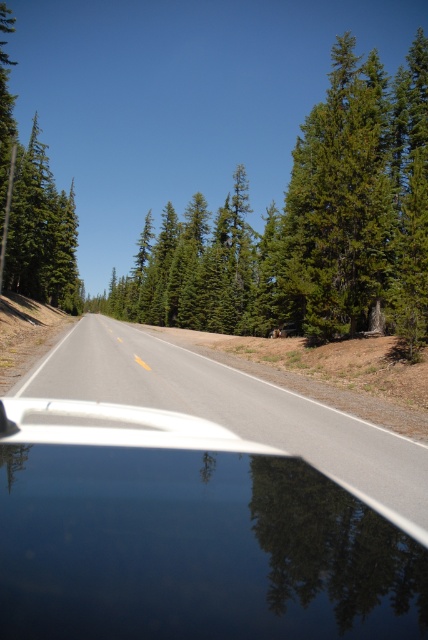
Is glossy black car at center below asphalt road at center?

Indeed, glossy black car at center is positioned under asphalt road at center.

The height and width of the screenshot is (640, 428). Identify the location of glossy black car at center. (187, 534).

How far apart are asphalt road at center and green matte tree at left?

A distance of 29.10 meters exists between asphalt road at center and green matte tree at left.

Can you confirm if asphalt road at center is positioned above green matte tree at left?

Actually, asphalt road at center is below green matte tree at left.

Image resolution: width=428 pixels, height=640 pixels. In order to click on asphalt road at center in this screenshot , I will do `click(231, 406)`.

Does green textured tree at center have a smaller size compared to asphalt road at center?

Actually, green textured tree at center might be larger than asphalt road at center.

The image size is (428, 640). What do you see at coordinates (308, 224) in the screenshot? I see `green textured tree at center` at bounding box center [308, 224].

The image size is (428, 640). What do you see at coordinates (308, 224) in the screenshot?
I see `green textured tree at center` at bounding box center [308, 224].

This screenshot has height=640, width=428. In order to click on green textured tree at center in this screenshot , I will do `click(308, 224)`.